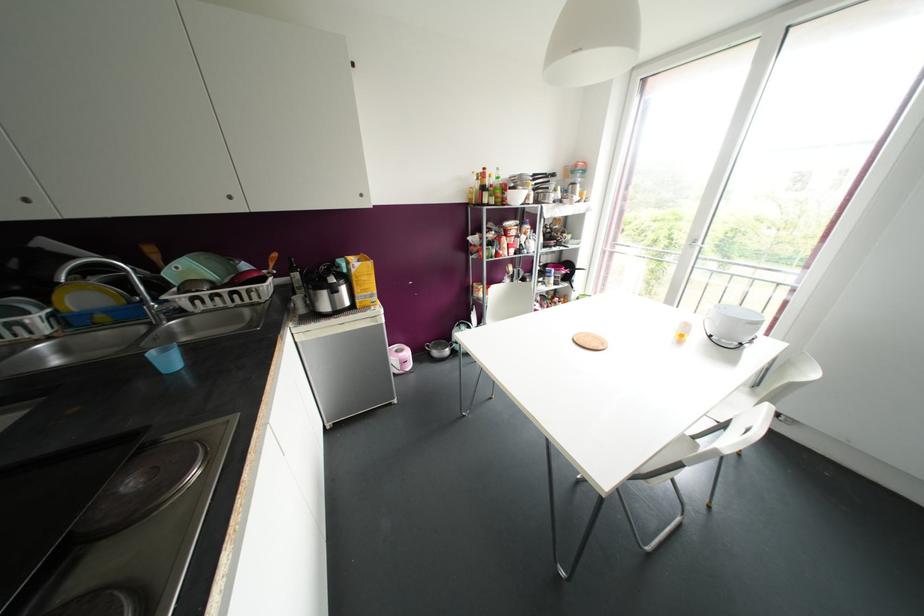
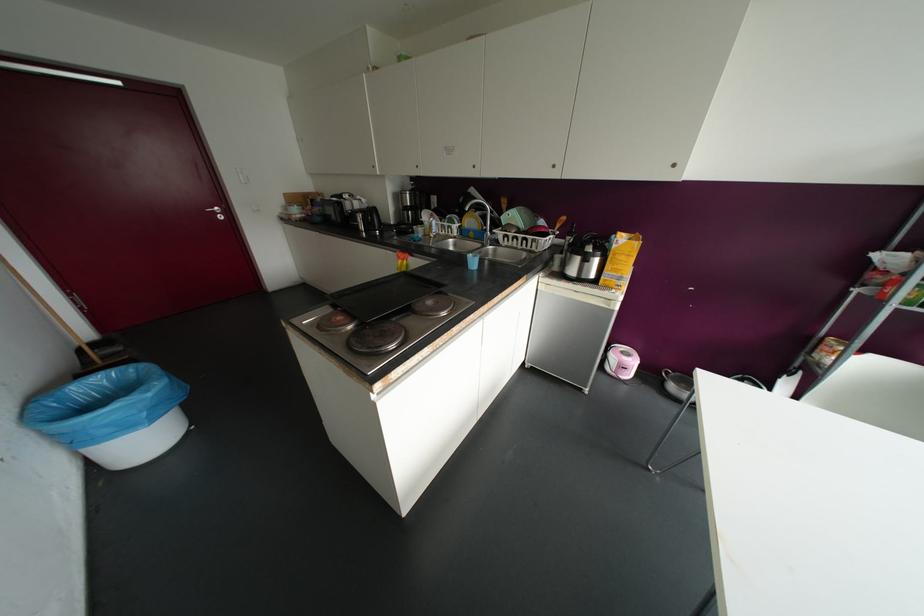
The point at (84, 296) is marked in the first image. Where is the corresponding point in the second image?

(469, 221)